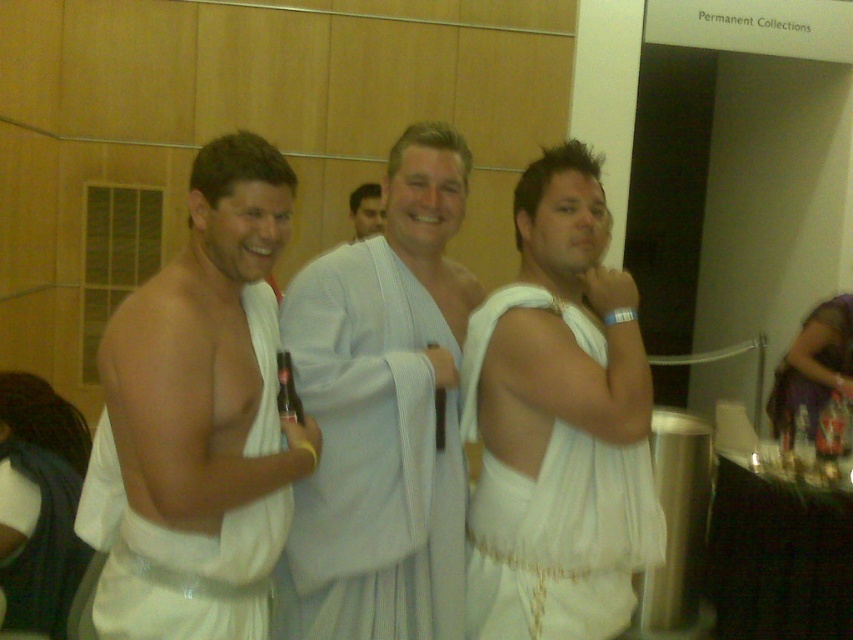
Can you confirm if muscle at center is smaller than white cloth toga at center?

Correct, muscle at center occupies less space than white cloth toga at center.

Who is more forward, (90,518) or (354,232)?

Point (90,518) is in front.

Is point (258, 326) closer to viewer compared to point (357, 193)?

Yes, it is in front of point (357, 193).

Where is `muscle at center`? muscle at center is located at coordinates (102, 488).

Can you confirm if white cotton toga at center is shorter than white cloth toga at center?

In fact, white cotton toga at center may be taller than white cloth toga at center.

Does white cotton toga at center have a smaller size compared to white cloth toga at center?

No.

Is point (383, 362) closer to camera compared to point (364, 195)?

Yes.

At what (x,y) coordinates should I click in order to perform the action: click on white cotton toga at center. Please return your answer as a coordinate pair (x, y). The width and height of the screenshot is (853, 640). Looking at the image, I should click on (383, 413).

Can you confirm if white cotton toga at center is smaller than muscle at center?

No, white cotton toga at center is not smaller than muscle at center.

Is white cotton toga at center wider than muscle at center?

Correct, the width of white cotton toga at center exceeds that of muscle at center.

Identify the location of white cotton toga at center. The width and height of the screenshot is (853, 640). (383, 413).

Image resolution: width=853 pixels, height=640 pixels. Find the location of `white cotton toga at center`. white cotton toga at center is located at coordinates (383, 413).